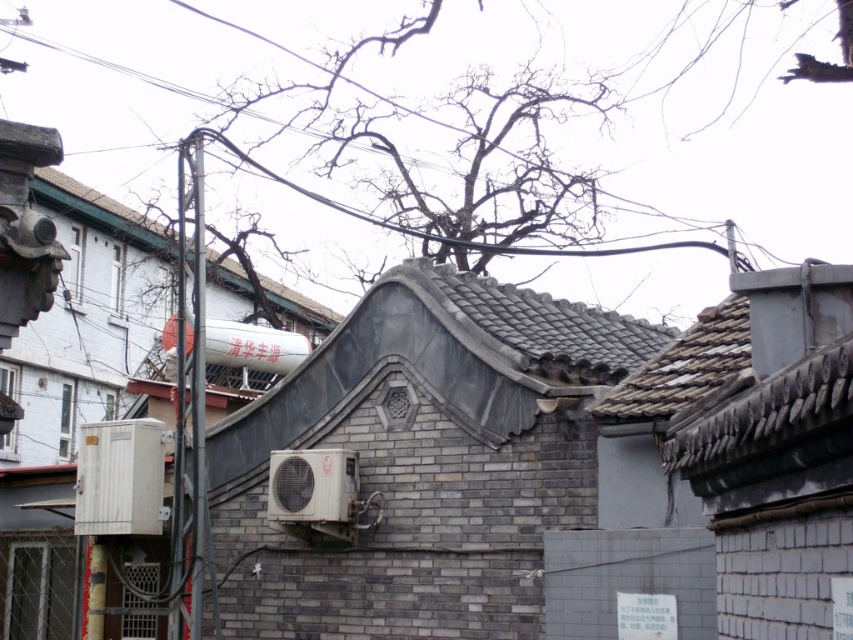
In the scene shown: Is gray tile roof at center taller than black wire at upper center?

Incorrect, gray tile roof at center's height is not larger of black wire at upper center's.

Between point (589, 346) and point (663, 211), which one is positioned behind?

The point (663, 211) is behind.

Where is `gray tile roof at center`? The image size is (853, 640). gray tile roof at center is located at coordinates (531, 324).

Identify the location of gray tile roof at center. Image resolution: width=853 pixels, height=640 pixels. (531, 324).

Looking at this image, can you confirm if gray tile roof at center is positioned to the right of gray tile roof at upper center?

Correct, you'll find gray tile roof at center to the right of gray tile roof at upper center.

Is gray tile roof at center positioned in front of gray tile roof at upper center?

Yes, gray tile roof at center is closer to the viewer.

This screenshot has height=640, width=853. I want to click on gray tile roof at center, so click(x=531, y=324).

Locate an element on the screen. The width and height of the screenshot is (853, 640). gray tile roof at center is located at coordinates (531, 324).

Can you confirm if gray tile roof at center is bigger than smooth metallic pole at left?

Correct, gray tile roof at center is larger in size than smooth metallic pole at left.

Is the position of gray tile roof at center less distant than that of smooth metallic pole at left?

Yes.

Identify the location of gray tile roof at center. (531, 324).